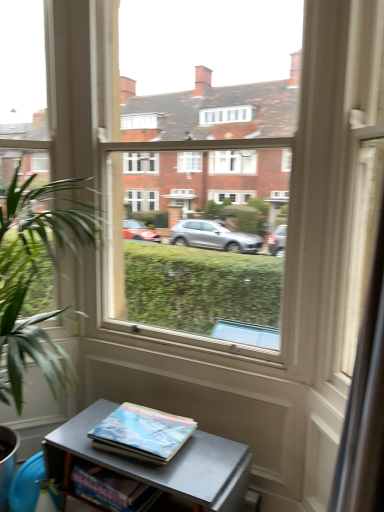
This screenshot has width=384, height=512. I want to click on vacant area to the right of hardcover book at center, the second book ordered from the bottom, so click(x=210, y=457).